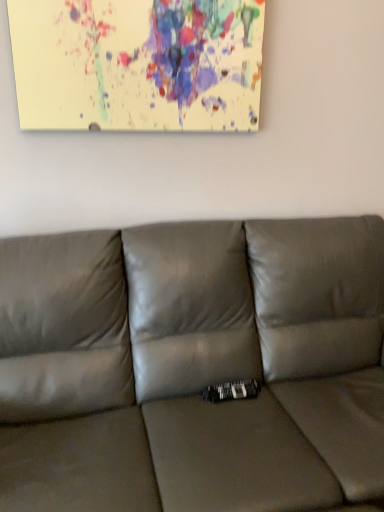
Locate an element on the screen. satin gray couch at center is located at coordinates (193, 367).

What do you see at coordinates (193, 367) in the screenshot?
I see `satin gray couch at center` at bounding box center [193, 367].

The width and height of the screenshot is (384, 512). What do you see at coordinates (137, 64) in the screenshot? I see `paint splatter canvas at upper center` at bounding box center [137, 64].

Measure the distance between point (242,73) and camera.

A distance of 1.66 meters exists between point (242,73) and camera.

The width and height of the screenshot is (384, 512). What are the coordinates of `paint splatter canvas at upper center` in the screenshot? It's located at (137, 64).

Locate an element on the screen. satin gray couch at center is located at coordinates (193, 367).

Which is more to the right, paint splatter canvas at upper center or satin gray couch at center?

Positioned to the right is satin gray couch at center.

Considering their positions, is paint splatter canvas at upper center located in front of or behind satin gray couch at center?

In the image, paint splatter canvas at upper center appears behind satin gray couch at center.

Considering the positions of point (36, 118) and point (250, 328), is point (36, 118) closer or farther from the camera than point (250, 328)?

Point (36, 118) is closer to the camera than point (250, 328).

From the image's perspective, relative to satin gray couch at center, is paint splatter canvas at upper center above or below?

Clearly, from the image's perspective, paint splatter canvas at upper center is above satin gray couch at center.

From a real-world perspective, is paint splatter canvas at upper center located higher than satin gray couch at center?

Indeed, from a real-world perspective, paint splatter canvas at upper center stands above satin gray couch at center.

Does paint splatter canvas at upper center have a greater width compared to satin gray couch at center?

No.

Is paint splatter canvas at upper center taller or shorter than satin gray couch at center?

Clearly, paint splatter canvas at upper center is shorter compared to satin gray couch at center.

Considering the sizes of paint splatter canvas at upper center and satin gray couch at center in the image, is paint splatter canvas at upper center bigger or smaller than satin gray couch at center?

Considering their sizes, paint splatter canvas at upper center takes up less space than satin gray couch at center.

Would you say paint splatter canvas at upper center is inside or outside satin gray couch at center?

paint splatter canvas at upper center exists outside the volume of satin gray couch at center.

Are paint splatter canvas at upper center and satin gray couch at center located far from each other?

paint splatter canvas at upper center is near satin gray couch at center, not far away.

Does paint splatter canvas at upper center turn towards satin gray couch at center?

No, paint splatter canvas at upper center is not facing towards satin gray couch at center.

What's the angular difference between paint splatter canvas at upper center and satin gray couch at center's facing directions?

They differ by 0.215 degrees in their facing directions.

In order to click on studio couch in front of the paint splatter canvas at upper center in this screenshot , I will do `click(193, 367)`.

Can you confirm if satin gray couch at center is positioned to the right of paint splatter canvas at upper center?

Yes, satin gray couch at center is to the right of paint splatter canvas at upper center.

Is satin gray couch at center in front of paint splatter canvas at upper center?

Yes, satin gray couch at center is in front of paint splatter canvas at upper center.

Does point (104, 437) lie in front of point (129, 76)?

Yes, point (104, 437) is in front of point (129, 76).

From the image's perspective, is satin gray couch at center above or below paint splatter canvas at upper center?

From the image's perspective, satin gray couch at center appears below paint splatter canvas at upper center.

From a real-world perspective, is satin gray couch at center on top of paint splatter canvas at upper center?

Incorrect, from a real-world perspective, satin gray couch at center is lower than paint splatter canvas at upper center.

Considering the sizes of objects satin gray couch at center and paint splatter canvas at upper center in the image provided, who is wider, satin gray couch at center or paint splatter canvas at upper center?

Wider between the two is satin gray couch at center.

Does satin gray couch at center have a lesser height compared to paint splatter canvas at upper center?

Incorrect, the height of satin gray couch at center does not fall short of that of paint splatter canvas at upper center.

Considering the relative sizes of satin gray couch at center and paint splatter canvas at upper center in the image provided, is satin gray couch at center bigger than paint splatter canvas at upper center?

Correct, satin gray couch at center is larger in size than paint splatter canvas at upper center.

Does satin gray couch at center contain paint splatter canvas at upper center?

No, paint splatter canvas at upper center is not inside satin gray couch at center.

Are satin gray couch at center and paint splatter canvas at upper center far apart?

No, satin gray couch at center is in close proximity to paint splatter canvas at upper center.

Is satin gray couch at center positioned with its back to paint splatter canvas at upper center?

satin gray couch at center does not have its back to paint splatter canvas at upper center.

What's the angular difference between satin gray couch at center and paint splatter canvas at upper center's facing directions?

The angular difference between satin gray couch at center and paint splatter canvas at upper center is 0.215 degrees.

Locate an element on the screen. studio couch lying in front of the paint splatter canvas at upper center is located at coordinates (193, 367).

This screenshot has height=512, width=384. I want to click on picture frame above the satin gray couch at center (from the image's perspective), so click(x=137, y=64).

You are a GUI agent. You are given a task and a screenshot of the screen. Output one action in this format:
    pyautogui.click(x=<x>, y=<y>)
    Task: Click on the picture frame lying behind the satin gray couch at center
    The image size is (384, 512).
    Given the screenshot: What is the action you would take?
    pyautogui.click(x=137, y=64)